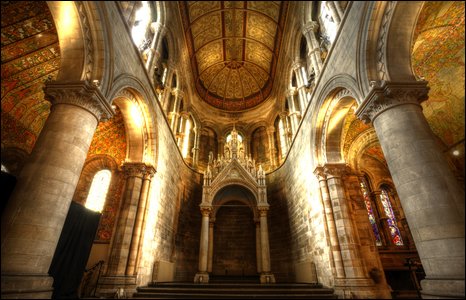
Identify the location of archway. The image size is (466, 300). (242, 175).